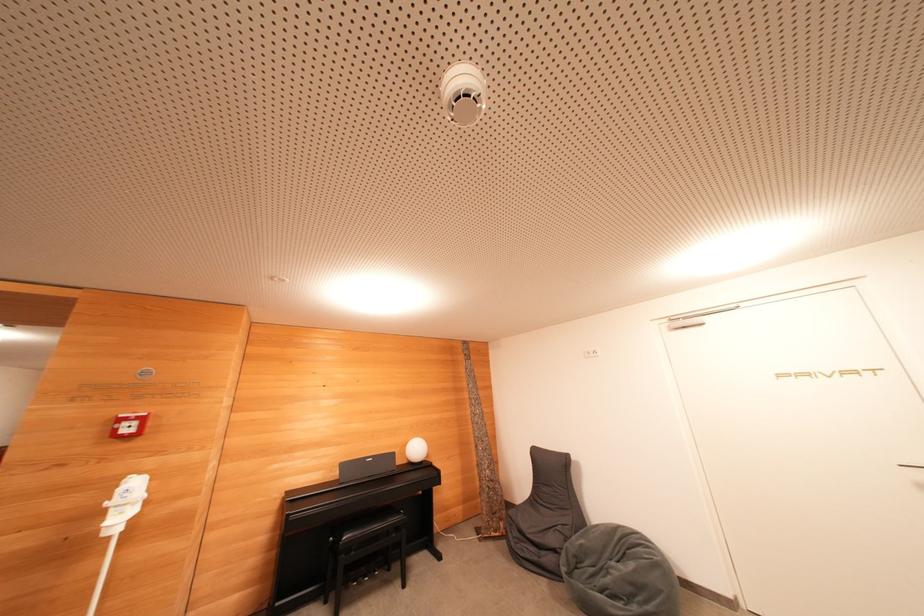
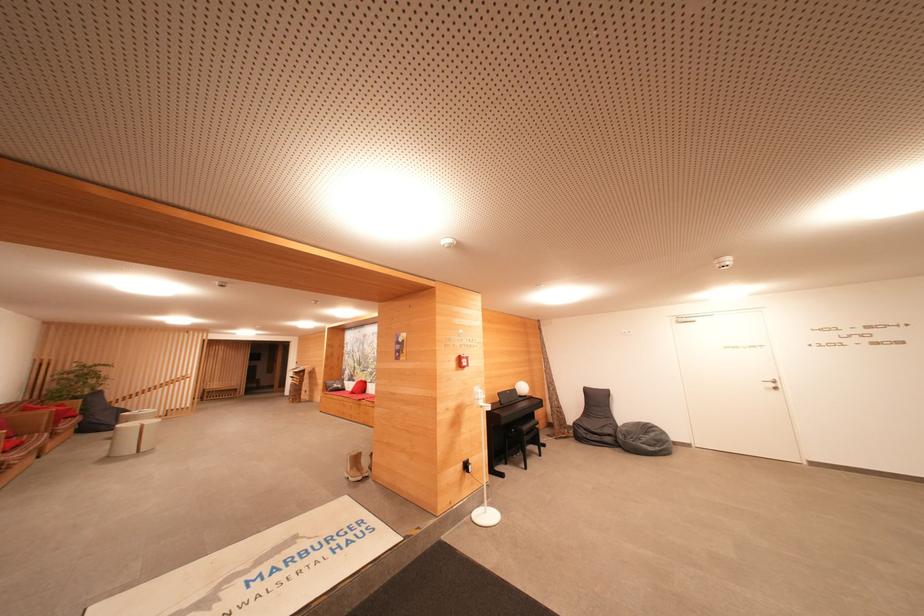
Where in the second image is the point corresponding to (635,569) from the first image?

(655, 438)